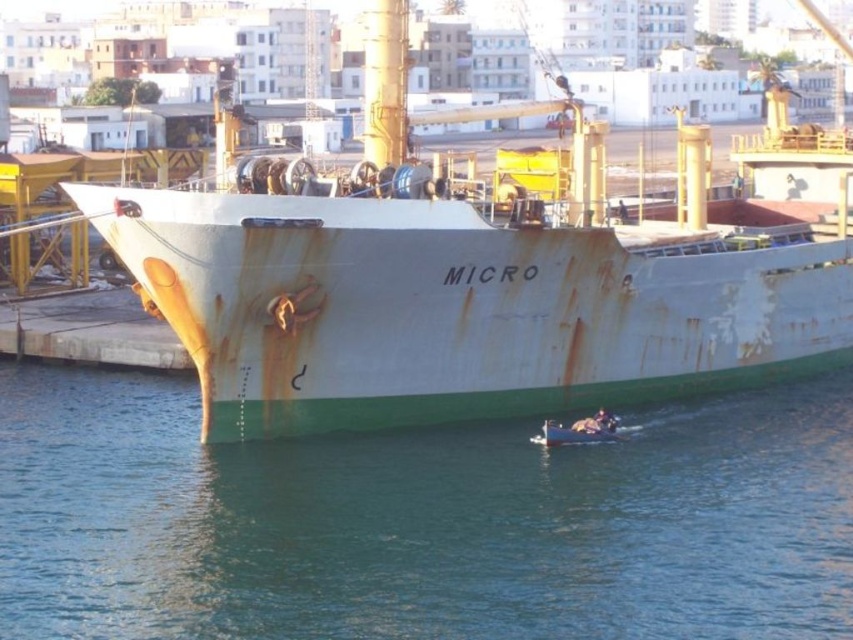
Question: Which object is positioned closest to the green matte water at lower center?

Choices:
 (A) rusty metal boat at lower center
 (B) rusty metal ship at center

Answer: (A)

Question: Which object is positioned closest to the rusty metal ship at center?

Choices:
 (A) rusty metal boat at lower center
 (B) green matte water at lower center

Answer: (B)

Question: Can you confirm if rusty metal ship at center is positioned above rusty metal boat at lower center?

Choices:
 (A) yes
 (B) no

Answer: (A)

Question: Among these points, which one is nearest to the camera?

Choices:
 (A) (219, 577)
 (B) (514, 164)

Answer: (A)

Question: Does green matte water at lower center appear under rusty metal boat at lower center?

Choices:
 (A) yes
 (B) no

Answer: (A)

Question: Can you confirm if rusty metal ship at center is positioned above rusty metal boat at lower center?

Choices:
 (A) no
 (B) yes

Answer: (B)